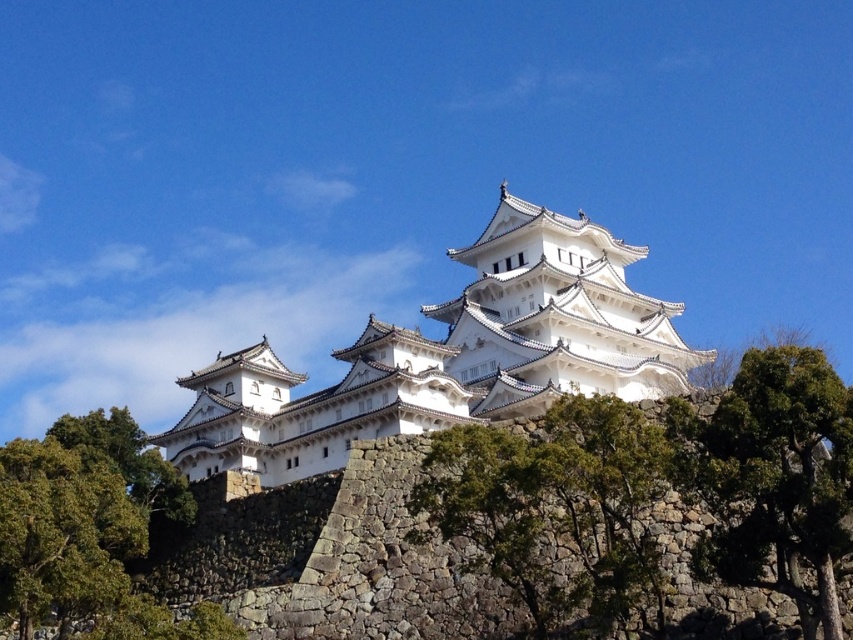
Between white stone castle at center and green leafy tree at lower left, which one is positioned lower?

green leafy tree at lower left is lower down.

Does white stone castle at center have a lesser height compared to green leafy tree at lower left?

In fact, white stone castle at center may be taller than green leafy tree at lower left.

What do you see at coordinates (450, 356) in the screenshot? I see `white stone castle at center` at bounding box center [450, 356].

Locate an element on the screen. The width and height of the screenshot is (853, 640). white stone castle at center is located at coordinates (450, 356).

You are a GUI agent. You are given a task and a screenshot of the screen. Output one action in this format:
    pyautogui.click(x=<x>, y=<y>)
    Task: Click on the green leafy tree at center
    
    Given the screenshot: What is the action you would take?
    pyautogui.click(x=775, y=477)

The height and width of the screenshot is (640, 853). Identify the location of green leafy tree at center. (775, 477).

Does point (544, 593) come farther from viewer compared to point (49, 557)?

Yes.

Can you confirm if green leafy tree at lower center is wider than green leafy tree at lower left?

No, green leafy tree at lower center is not wider than green leafy tree at lower left.

What do you see at coordinates (556, 509) in the screenshot? Image resolution: width=853 pixels, height=640 pixels. I see `green leafy tree at lower center` at bounding box center [556, 509].

The height and width of the screenshot is (640, 853). What are the coordinates of `green leafy tree at lower center` in the screenshot? It's located at (556, 509).